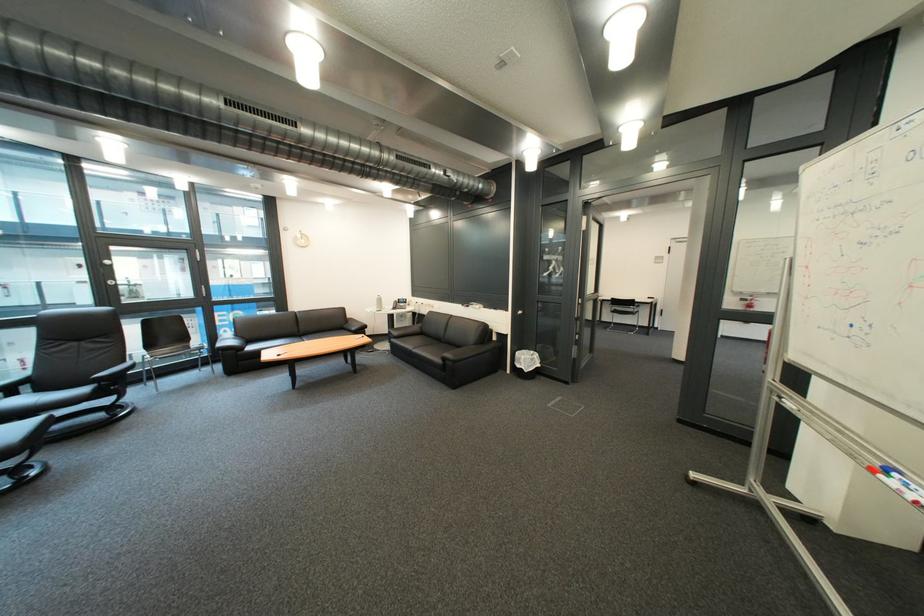
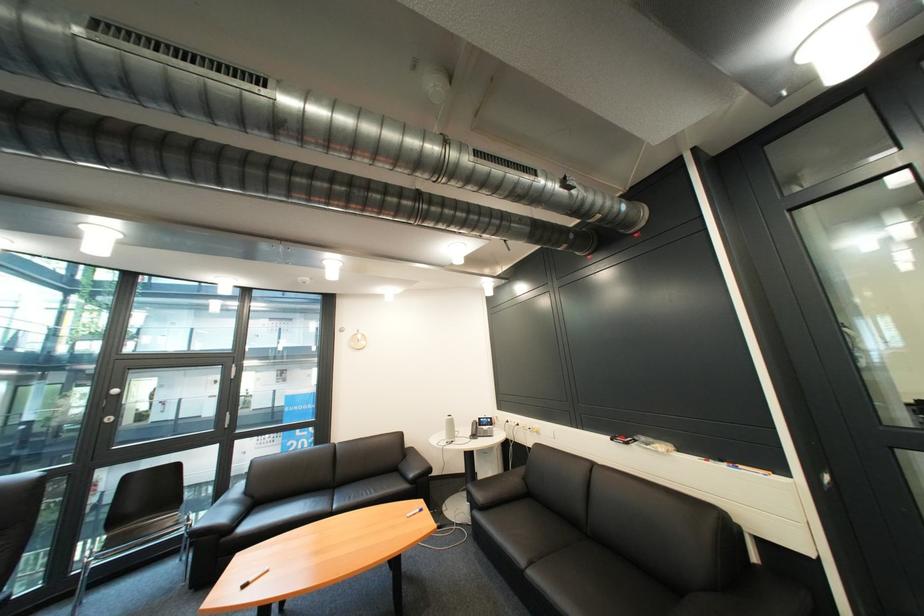
Locate, in the second image, the point that corresponds to point (506, 312) in the first image.

(736, 468)